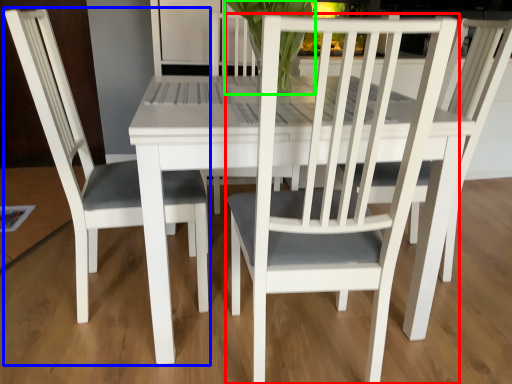
Question: Estimate the real-world distances between objects in this image. Which object is closer to chair (highlighted by a red box), chair (highlighted by a blue box) or orchid (highlighted by a green box)?

Choices:
 (A) chair
 (B) orchid

Answer: (A)